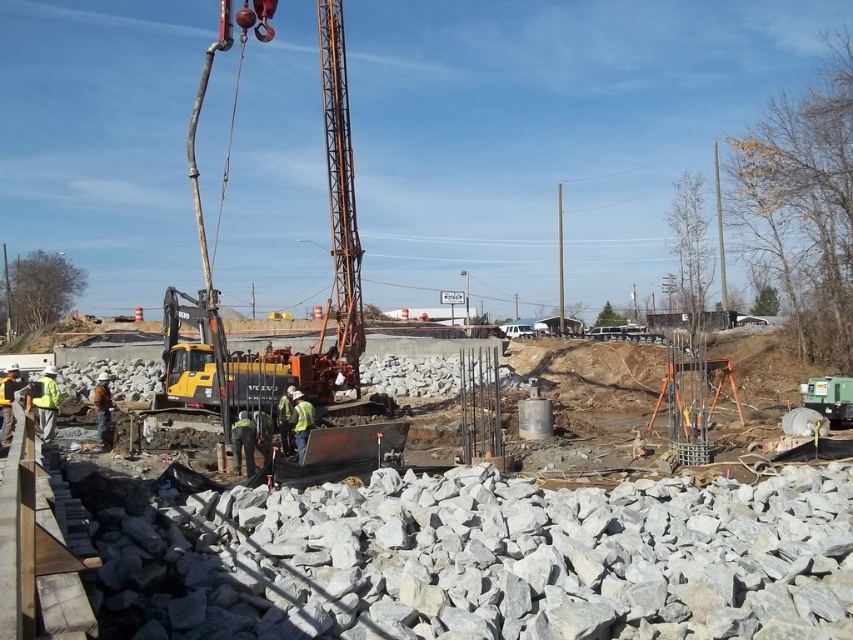
Find the location of a particular element. This screenshot has width=853, height=640. gray concrete construction site at center is located at coordinates (477, 557).

In order to click on gray concrete construction site at center in this screenshot , I will do `click(477, 557)`.